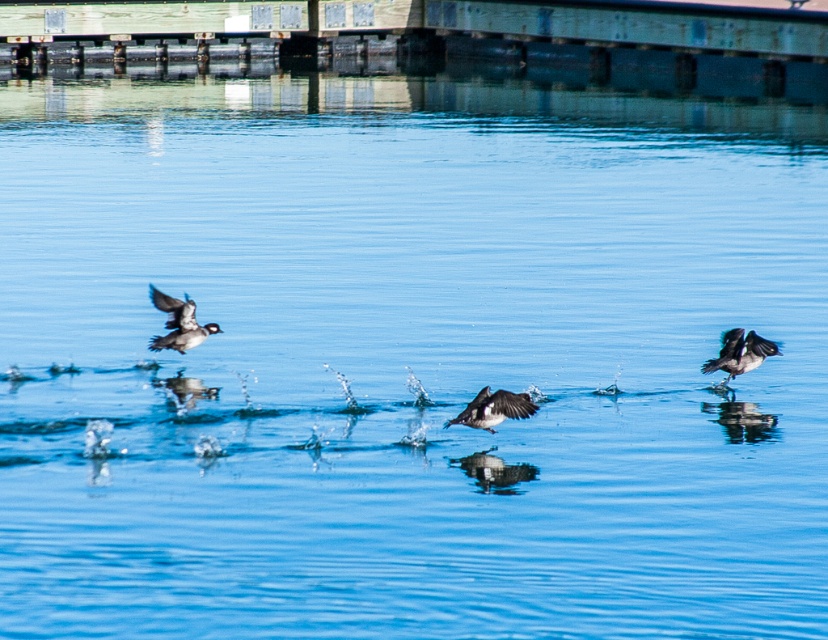
You are an observer looking at the scene. From your viewpoint, which object is closer to you between the green painted wood at upper center and the speckled feathered duck at center?

The green painted wood at upper center is closer to you because the speckled feathered duck at center is positioned behind it.

You are observing the serene water scene with ducks in flight. You notice the green painted wood at upper center and the brown speckled feathers at upper left. Which object is positioned higher in the image?

The green painted wood at upper center is located above the brown speckled feathers at upper left, so it is positioned higher in the image.

You are a photographer trying to capture the speckled feathered duck at center. You notice the green painted wood at upper center might block your view. Based on the scene description, can you see the duck clearly without any obstruction from the green painted wood?

The green painted wood at upper center is positioned over the speckled feathered duck at center, so it would obstruct the view of the duck. You cannot see the duck clearly without moving the wood or adjusting your angle to avoid the obstruction.